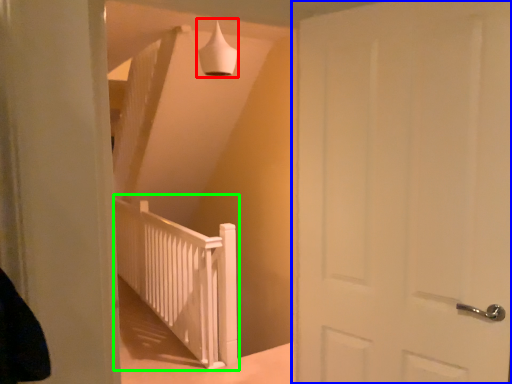
Question: Estimate the real-world distances between objects in this image. Which object is closer to lamp (highlighted by a red box), door (highlighted by a blue box) or rail (highlighted by a green box)?

Choices:
 (A) door
 (B) rail

Answer: (A)